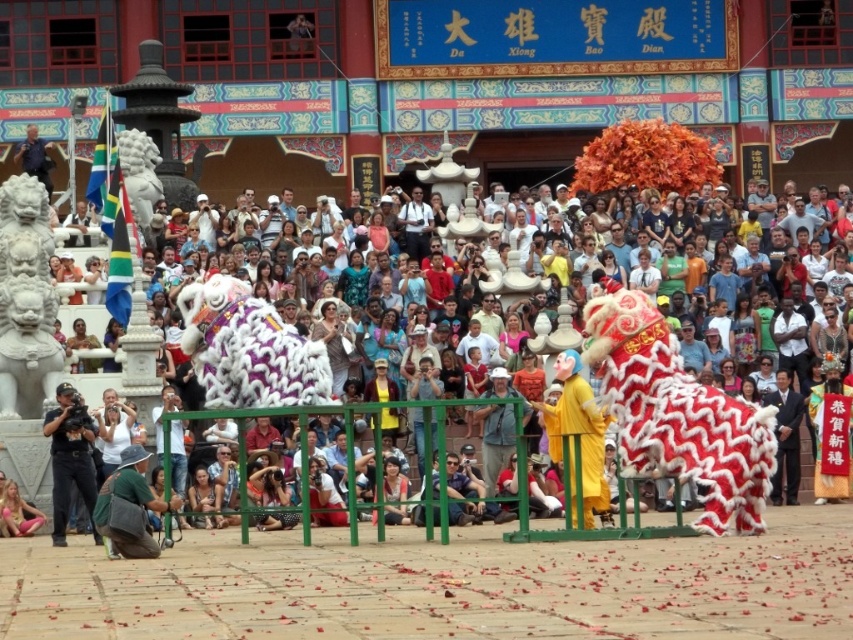
Question: Which point is farther from the camera taking this photo?

Choices:
 (A) (697, 518)
 (B) (93, 428)
 (C) (210, 321)

Answer: (C)

Question: Does black matte camera at lower left appear under green fabric bag at lower left?

Choices:
 (A) yes
 (B) no

Answer: (A)

Question: Is black matte camera at lower left closer to camera compared to pink fabric at lower left?

Choices:
 (A) no
 (B) yes

Answer: (B)

Question: Among these points, which one is farthest from the camera?

Choices:
 (A) (293, 396)
 (B) (733, 483)
 (C) (6, 516)

Answer: (C)

Question: Which of the following is the closest to the observer?

Choices:
 (A) (144, 500)
 (B) (91, 506)

Answer: (A)

Question: Can you confirm if red and white fur lion at center is positioned to the left of white fluffy lion at center?

Choices:
 (A) yes
 (B) no

Answer: (B)